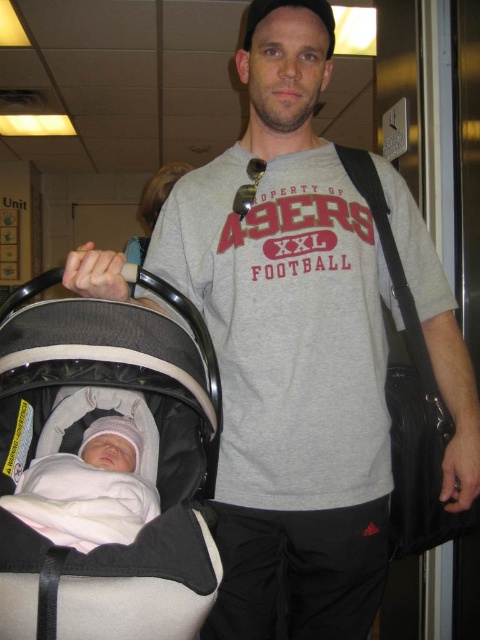
Question: Which point is closer to the camera?

Choices:
 (A) soft pink fabric at center
 (B) beige fabric baby carriage at center

Answer: (B)

Question: Can you confirm if beige fabric baby carriage at center is smaller than soft pink fabric at center?

Choices:
 (A) no
 (B) yes

Answer: (A)

Question: Can you confirm if beige fabric baby carriage at center is positioned above soft pink fabric at center?

Choices:
 (A) yes
 (B) no

Answer: (A)

Question: Does beige fabric baby carriage at center have a greater width compared to soft pink fabric at center?

Choices:
 (A) no
 (B) yes

Answer: (B)

Question: Which point appears farthest from the camera in this image?

Choices:
 (A) (128, 461)
 (B) (135, 420)

Answer: (B)